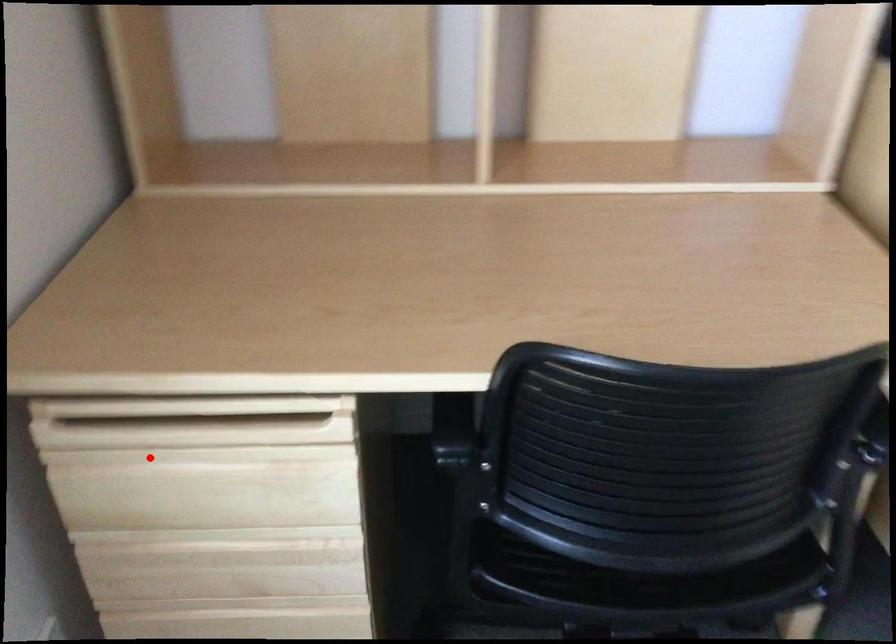
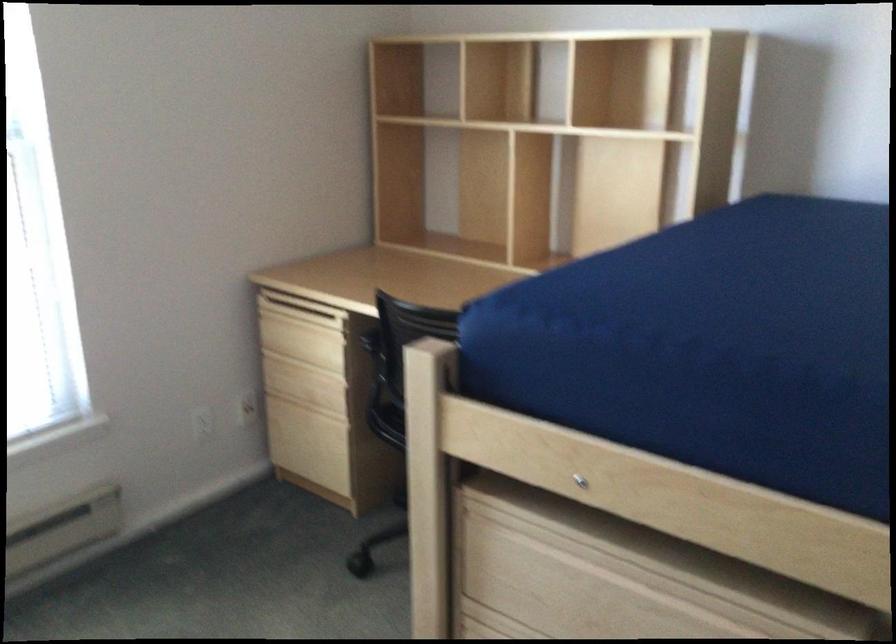
Locate, in the second image, the point that corresponds to the highlighted location in the first image.

(285, 319)